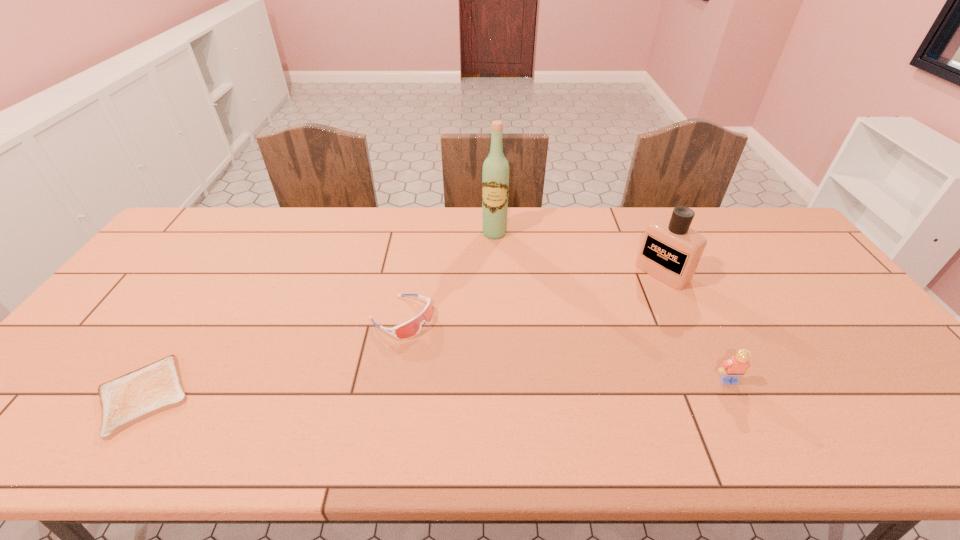
The height and width of the screenshot is (540, 960). I want to click on the shortest object, so point(135,396).

You are a GUI agent. You are given a task and a screenshot of the screen. Output one action in this format:
    pyautogui.click(x=<x>, y=<y>)
    Task: Click on the toast
    This screenshot has height=540, width=960.
    Given the screenshot: What is the action you would take?
    pyautogui.click(x=135, y=396)

Find the location of a particular element. the third shortest object is located at coordinates (732, 369).

Locate an element on the screen. The image size is (960, 540). the fourth shortest object is located at coordinates (670, 251).

The width and height of the screenshot is (960, 540). What are the coordinates of `perfume` in the screenshot? It's located at (670, 251).

This screenshot has height=540, width=960. What are the coordinates of `the third nearest object` in the screenshot? It's located at (410, 328).

I want to click on the second shortest object, so click(x=410, y=328).

Where is `the tallest object`? the tallest object is located at coordinates (495, 175).

The width and height of the screenshot is (960, 540). Identify the location of wine bottle. (495, 175).

The image size is (960, 540). Find the location of `free region located 0.180m on the back of the toast`. free region located 0.180m on the back of the toast is located at coordinates (202, 307).